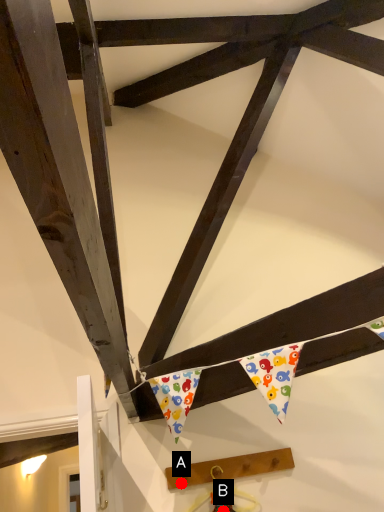
Question: Two points are circled on the image, labeled by A and B beside each circle. Which point is closer to the camera?

Choices:
 (A) A is closer
 (B) B is closer

Answer: (B)